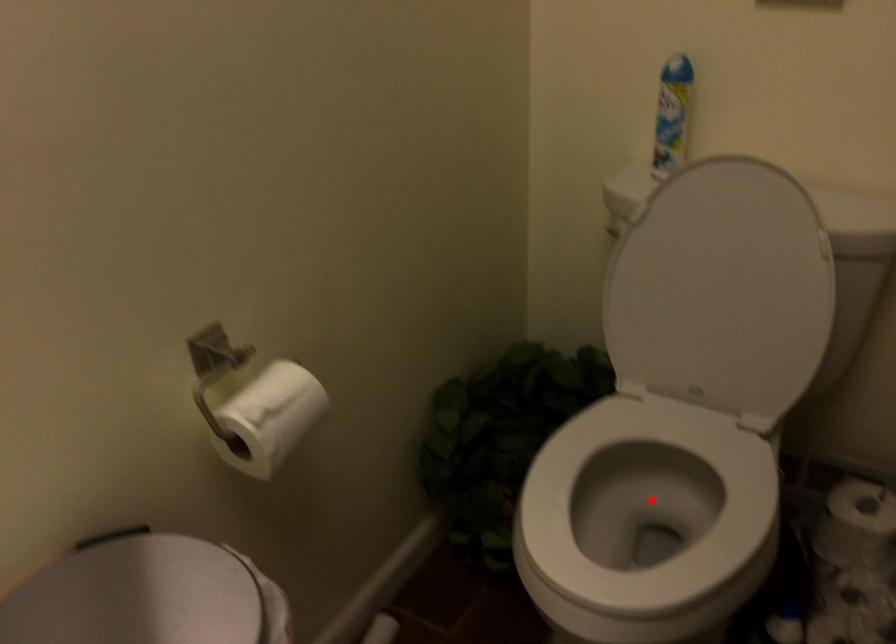
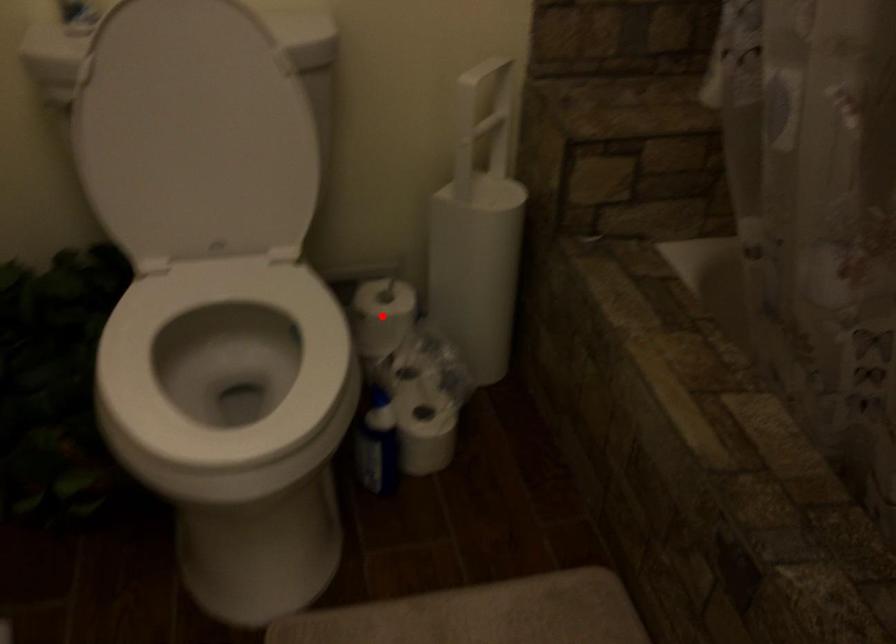
I am providing you with two images of the same scene from different viewpoints. A red point is marked on the first image and another point is marked on the second image. Does the point marked in image1 correspond to the same location as the one in image2?

No